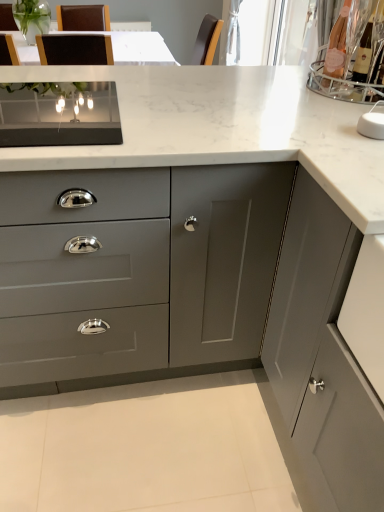
Question: Would you say matte gray cabinet at center, the first cabinetry positioned from the back, is outside matte gray cabinet at right, placed as the 2th cabinetry when sorted from left to right?

Choices:
 (A) no
 (B) yes

Answer: (B)

Question: Does matte gray cabinet at center, the first cabinetry positioned from the back, turn towards matte gray cabinet at right, which is counted as the 2th cabinetry, starting from the back?

Choices:
 (A) no
 (B) yes

Answer: (A)

Question: Can you confirm if matte gray cabinet at center, the first cabinetry positioned from the back, is smaller than matte gray cabinet at right, the first cabinetry from the front?

Choices:
 (A) no
 (B) yes

Answer: (B)

Question: Is the position of matte gray cabinet at center, arranged as the second cabinetry when viewed from the right, less distant than that of matte gray cabinet at right, the first cabinetry in the right-to-left sequence?

Choices:
 (A) yes
 (B) no

Answer: (B)

Question: From the image's perspective, is matte gray cabinet at center, arranged as the second cabinetry when viewed from the right, located above matte gray cabinet at right, the first cabinetry in the right-to-left sequence?

Choices:
 (A) yes
 (B) no

Answer: (A)

Question: From a real-world perspective, is matte gray cabinet at center, which is the second cabinetry from front to back, physically below matte gray cabinet at right, the first cabinetry in the right-to-left sequence?

Choices:
 (A) no
 (B) yes

Answer: (B)

Question: Is matte gray cabinet at right, which is counted as the 2th cabinetry, starting from the back, wider than matte gray cabinet at center, the first cabinetry positioned from the back?

Choices:
 (A) yes
 (B) no

Answer: (B)

Question: Is matte gray cabinet at right, the first cabinetry from the front, next to matte gray cabinet at center, arranged as the second cabinetry when viewed from the right?

Choices:
 (A) no
 (B) yes

Answer: (A)

Question: Is matte gray cabinet at right, the first cabinetry in the right-to-left sequence, surrounding matte gray cabinet at center, arranged as the second cabinetry when viewed from the right?

Choices:
 (A) yes
 (B) no

Answer: (B)

Question: Is matte gray cabinet at right, placed as the 2th cabinetry when sorted from left to right, closer to camera compared to matte gray cabinet at center, arranged as the second cabinetry when viewed from the right?

Choices:
 (A) yes
 (B) no

Answer: (A)

Question: Is matte gray cabinet at right, the first cabinetry from the front, positioned behind matte gray cabinet at center, which is the second cabinetry from front to back?

Choices:
 (A) no
 (B) yes

Answer: (A)

Question: From the image's perspective, is matte gray cabinet at right, which is counted as the 2th cabinetry, starting from the back, located beneath matte gray cabinet at center, which is the second cabinetry from front to back?

Choices:
 (A) no
 (B) yes

Answer: (B)

Question: From the image's perspective, relative to matte gray cabinet at right, placed as the 2th cabinetry when sorted from left to right, is matte gray cabinet at center, arranged as the second cabinetry when viewed from the right, above or below?

Choices:
 (A) above
 (B) below

Answer: (A)